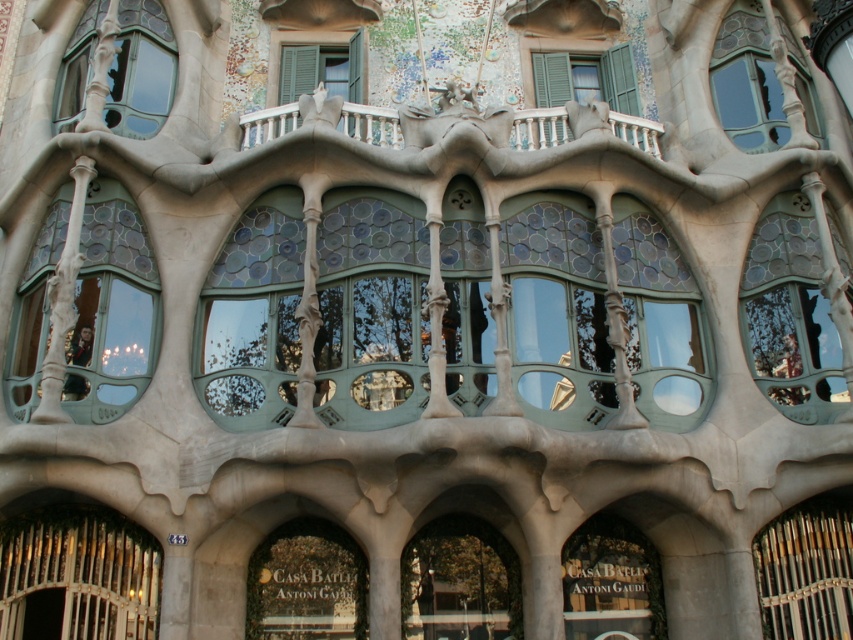
Question: Does translucent glass window at upper left have a smaller size compared to green glass window at center?

Choices:
 (A) yes
 (B) no

Answer: (B)

Question: Is green glass window at center bigger than matte gray stone at upper center?

Choices:
 (A) no
 (B) yes

Answer: (A)

Question: Among these points, which one is nearest to the camera?

Choices:
 (A) (309, 64)
 (B) (42, 284)
 (C) (659, 600)

Answer: (B)

Question: Estimate the real-world distances between objects in this image. Which object is farther from the translucent glass window at upper left?

Choices:
 (A) transparent glass window at upper right
 (B) green matte shutters at upper center
 (C) translucent glass window at left
 (D) green glass window at center

Answer: (A)

Question: Is transparent glass window at upper right behind matte gray stone at upper center?

Choices:
 (A) no
 (B) yes

Answer: (B)

Question: Among these objects, which one is farthest from the camera?

Choices:
 (A) green glass window at center
 (B) green matte shutters at upper center

Answer: (B)